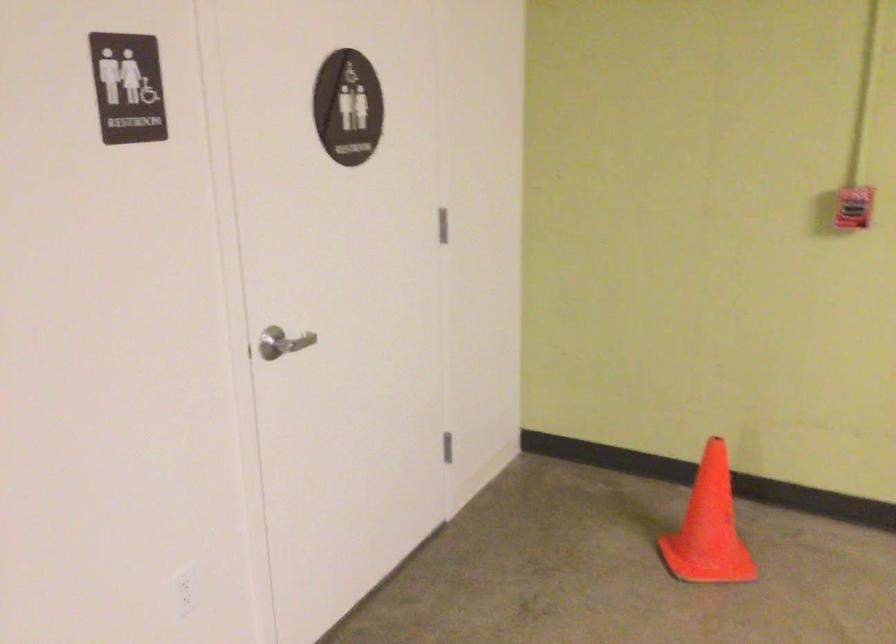
This screenshot has width=896, height=644. What do you see at coordinates (281, 343) in the screenshot?
I see `the silver door handle` at bounding box center [281, 343].